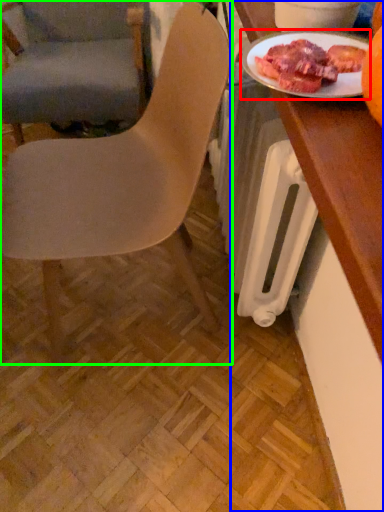
Question: Which object is positioned farthest from tableware (highlighted by a red box)? Select from desk (highlighted by a blue box) and chair (highlighted by a green box).

Choices:
 (A) desk
 (B) chair

Answer: (B)